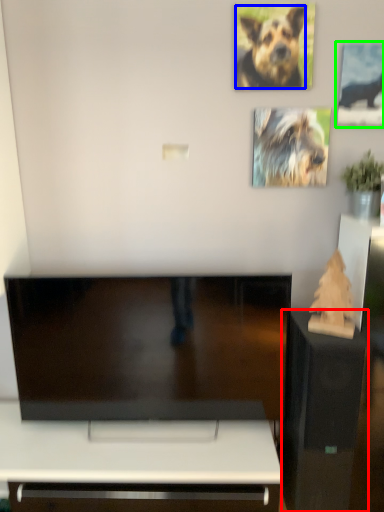
Question: Which object is positioned farthest from furniture (highlighted by a red box)? Select from dog (highlighted by a blue box) and picture frame (highlighted by a green box).

Choices:
 (A) dog
 (B) picture frame

Answer: (A)